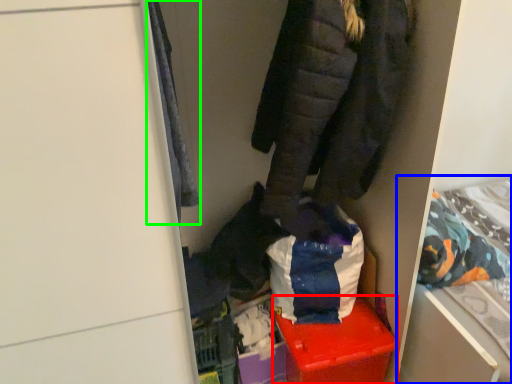
Question: Which object is positioned closest to storage box (highlighted by a red box)? Select from bed (highlighted by a blue box) and cloak (highlighted by a green box).

Choices:
 (A) bed
 (B) cloak

Answer: (A)